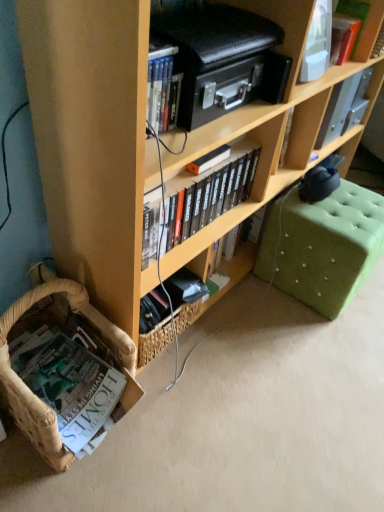
Locate an element on the screen. This screenshot has width=384, height=512. free space in front of green tufted ottoman at lower right is located at coordinates (312, 337).